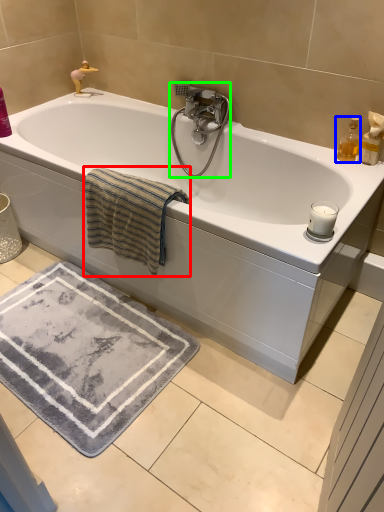
Question: Based on their relative distances, which object is nearer to bath towel (highlighted by a red box)? Choose from soap dispenser (highlighted by a blue box) and tap (highlighted by a green box).

Choices:
 (A) soap dispenser
 (B) tap

Answer: (B)